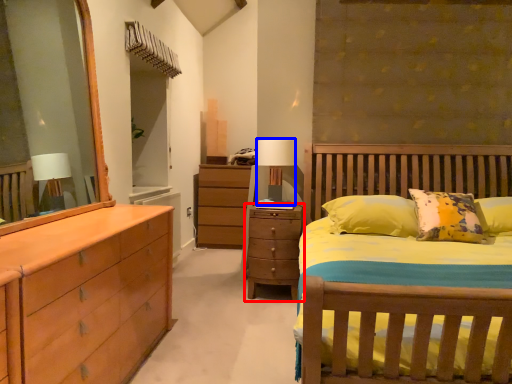
Question: Among these objects, which one is farthest to the camera, chest of drawers (highlighted by a red box) or table lamp (highlighted by a blue box)?

Choices:
 (A) chest of drawers
 (B) table lamp

Answer: (B)